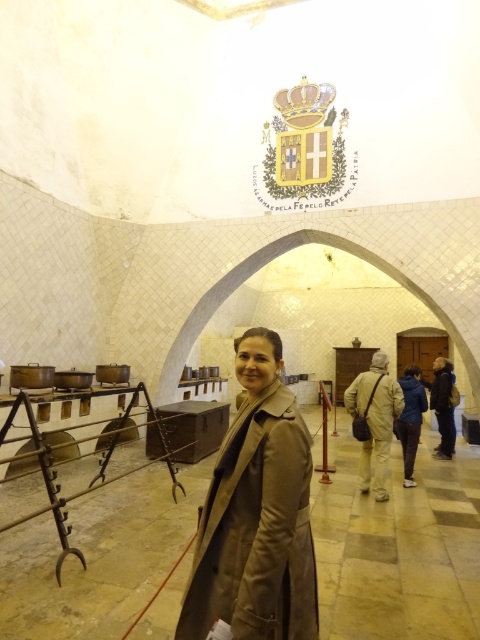
Between beige leather coat at center and dark blue jacket at center, which one appears on the right side from the viewer's perspective?

dark blue jacket at center is more to the right.

Can you confirm if beige leather coat at center is smaller than dark blue jacket at center?

No, beige leather coat at center is not smaller than dark blue jacket at center.

Which is behind, point (290, 522) or point (443, 369)?

The point (443, 369) is behind.

The height and width of the screenshot is (640, 480). Identify the location of beige leather coat at center. (256, 513).

Which of these two, khaki fabric pants at center or blue fabric jacket at center, stands shorter?

blue fabric jacket at center is shorter.

Which is in front, point (380, 380) or point (409, 413)?

Positioned in front is point (380, 380).

Who is more forward, (384, 493) or (416, 387)?

Point (384, 493)

Image resolution: width=480 pixels, height=640 pixels. I want to click on khaki fabric pants at center, so click(374, 420).

Does khaki fabric pants at center lie in front of brown leather bag at center?

No, khaki fabric pants at center is further to the viewer.

Is khaki fabric pants at center to the right of brown leather bag at center from the viewer's perspective?

Correct, you'll find khaki fabric pants at center to the right of brown leather bag at center.

You are a GUI agent. You are given a task and a screenshot of the screen. Output one action in this format:
    pyautogui.click(x=<x>, y=<y>)
    Task: Click on the khaki fabric pants at center
    This screenshot has width=480, height=640.
    Given the screenshot: What is the action you would take?
    pyautogui.click(x=374, y=420)

Locate an element on the screen. This screenshot has height=640, width=480. khaki fabric pants at center is located at coordinates (374, 420).